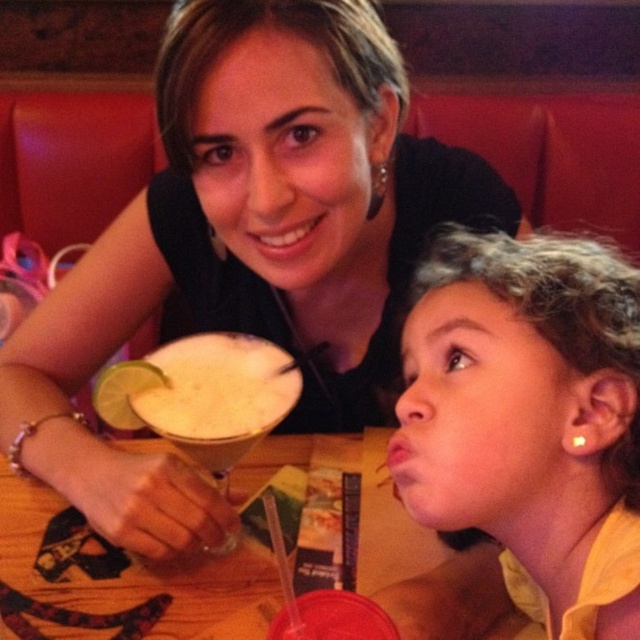
Question: Is matte yellow shirt at center above wooden table at center?

Choices:
 (A) no
 (B) yes

Answer: (B)

Question: In this image, where is matte black dress at center located relative to white foam cocktail at center?

Choices:
 (A) above
 (B) below

Answer: (A)

Question: Which of the following is the closest to the observer?

Choices:
 (A) white foam cocktail at center
 (B) matte black dress at center
 (C) matte yellow shirt at center
 (D) wooden table at center

Answer: (C)

Question: Is matte black dress at center above wooden table at center?

Choices:
 (A) yes
 (B) no

Answer: (A)

Question: Which object is farther from the camera taking this photo?

Choices:
 (A) matte black dress at center
 (B) white foam cocktail at center
 (C) matte yellow shirt at center

Answer: (B)

Question: Among these objects, which one is farthest from the camera?

Choices:
 (A) wooden table at center
 (B) matte black dress at center
 (C) white foam cocktail at center

Answer: (C)